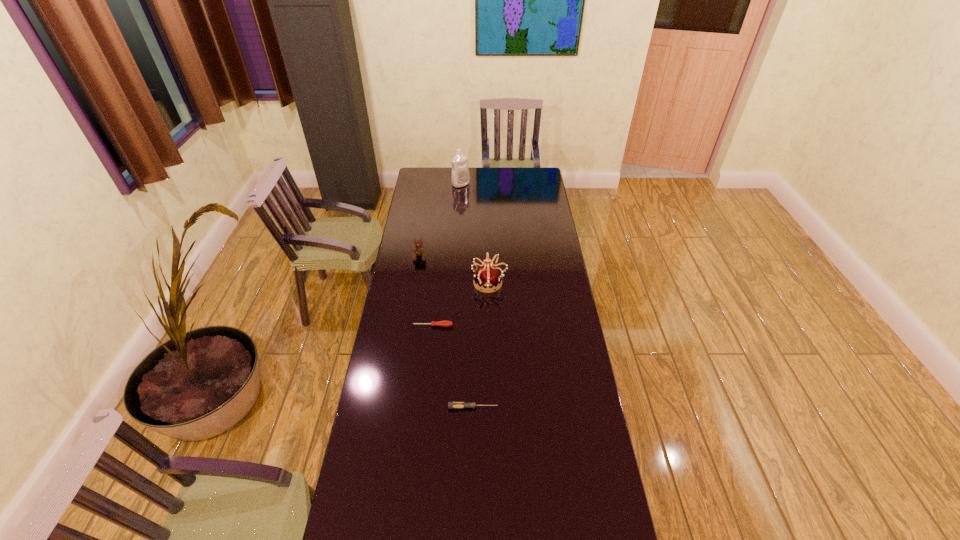
The height and width of the screenshot is (540, 960). Identify the location of empty space that is in between the nearer screwdriver and the second farthest object. (446, 332).

Where is `object that stands as the third closest to the second tallest object`? The image size is (960, 540). object that stands as the third closest to the second tallest object is located at coordinates (451, 405).

Identify which object is the third closest to the teddy bear. Please provide its 2D coordinates. Your answer should be formatted as a tuple, i.e. [(x, y)], where the tuple contains the x and y coordinates of a point satisfying the conditions above.

[(460, 177)]

Image resolution: width=960 pixels, height=540 pixels. I want to click on screwdriver that stands as the closest to the third shortest object, so click(x=440, y=323).

Locate which screwdriver ranks in proximity to the tiara. Please provide its 2D coordinates. Your answer should be formatted as a tuple, i.e. [(x, y)], where the tuple contains the x and y coordinates of a point satisfying the conditions above.

[(440, 323)]

The width and height of the screenshot is (960, 540). In order to click on vacant space that satisfies the following two spatial constraints: 1. on the face of the farther screwdriver; 2. on the right side of the third tallest object in this screenshot , I will do `click(409, 326)`.

At what (x,y) coordinates should I click in order to perform the action: click on vacant area in the image that satisfies the following two spatial constraints: 1. on the face of the left screwdriver; 2. on the right side of the second farthest object. Please return your answer as a coordinate pair (x, y). Looking at the image, I should click on (409, 326).